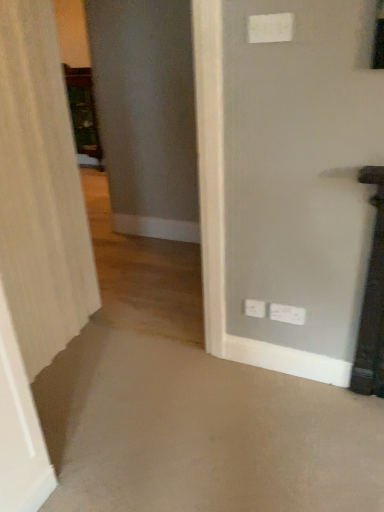
Question: Is white plastic electric outlet at upper center, arranged as the first electric outlet when viewed from the top, thinner than white plastic electric outlet at lower right, the first electric outlet from the back?

Choices:
 (A) no
 (B) yes

Answer: (B)

Question: Does white plastic electric outlet at upper center, arranged as the first electric outlet when viewed from the top, have a larger size compared to white plastic electric outlet at lower right, which is counted as the 3th electric outlet, starting from the front?

Choices:
 (A) no
 (B) yes

Answer: (A)

Question: Is white plastic electric outlet at lower right, which is the 2th electric outlet from top to bottom, at the back of white plastic electric outlet at upper center, arranged as the third electric outlet when viewed from the back?

Choices:
 (A) no
 (B) yes

Answer: (A)

Question: Is white plastic electric outlet at lower right, which is counted as the 3th electric outlet, starting from the front, completely or partially inside white plastic electric outlet at upper center, arranged as the third electric outlet when viewed from the back?

Choices:
 (A) no
 (B) yes

Answer: (A)

Question: Could you tell me if white plastic electric outlet at upper center, arranged as the third electric outlet when viewed from the back, is facing white plastic electric outlet at lower right, placed as the 2th electric outlet when sorted from bottom to top?

Choices:
 (A) no
 (B) yes

Answer: (A)

Question: From the image's perspective, would you say white plastic electric outlet at upper center, arranged as the third electric outlet when viewed from the back, is shown under white plastic electric outlet at lower right, placed as the 2th electric outlet when sorted from bottom to top?

Choices:
 (A) no
 (B) yes

Answer: (A)

Question: Can you confirm if white plastic electric outlet at lower right, which is the second electric outlet in front-to-back order, is thinner than white plastic electric outlet at upper center, arranged as the third electric outlet when viewed from the back?

Choices:
 (A) yes
 (B) no

Answer: (B)

Question: Is white plastic electric outlet at lower right, which is the 3th electric outlet in top-to-bottom order, smaller than white plastic electric outlet at upper center, arranged as the first electric outlet when viewed from the top?

Choices:
 (A) no
 (B) yes

Answer: (A)

Question: Is white plastic electric outlet at lower right, which is the second electric outlet in front-to-back order, positioned beyond the bounds of white plastic electric outlet at upper center, arranged as the first electric outlet when viewed from the front?

Choices:
 (A) yes
 (B) no

Answer: (A)

Question: From a real-world perspective, is white plastic electric outlet at lower right, which is counted as the 1th electric outlet, starting from the bottom, located higher than white plastic electric outlet at upper center, arranged as the first electric outlet when viewed from the top?

Choices:
 (A) no
 (B) yes

Answer: (A)

Question: Is white plastic electric outlet at lower right, which is counted as the 1th electric outlet, starting from the bottom, shorter than white plastic electric outlet at upper center, arranged as the first electric outlet when viewed from the top?

Choices:
 (A) yes
 (B) no

Answer: (B)

Question: Is white plastic electric outlet at lower right, which is the 2th electric outlet in back-to-front order, next to white plastic electric outlet at upper center, the 3th electric outlet positioned from the bottom, and touching it?

Choices:
 (A) yes
 (B) no

Answer: (B)

Question: Is wooden cabinet at left wider than white textured curtain at left?

Choices:
 (A) no
 (B) yes

Answer: (B)